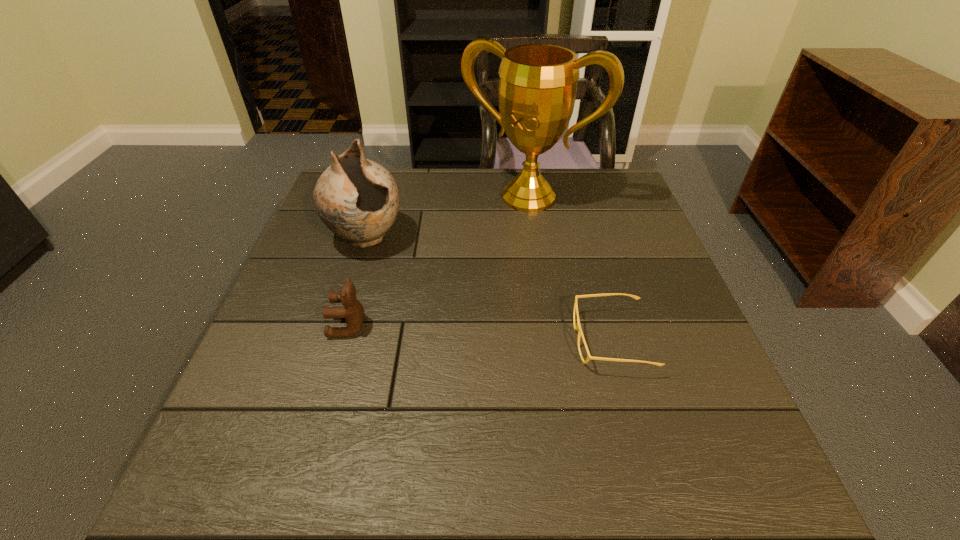
Where is `free space located on the front-facing side of the tallest object`? free space located on the front-facing side of the tallest object is located at coordinates (499, 225).

Image resolution: width=960 pixels, height=540 pixels. I want to click on vacant space located on the front-facing side of the tallest object, so click(488, 244).

Image resolution: width=960 pixels, height=540 pixels. Identify the location of vacant point located 0.270m from the spout of the second tallest object. (445, 321).

At what (x,y) coordinates should I click in order to perform the action: click on free spot located from the spout of the second tallest object. Please return your answer as a coordinate pair (x, y). Looking at the image, I should click on (445, 321).

Locate an element on the screen. The width and height of the screenshot is (960, 540). free space located from the spout of the second tallest object is located at coordinates (416, 291).

I want to click on object that is at the far edge, so click(537, 89).

Locate an element on the screen. teddy bear that is at the left edge is located at coordinates (353, 312).

Locate an element on the screen. pottery present at the left edge is located at coordinates (358, 199).

At what (x,y) coordinates should I click in order to perform the action: click on spectacles at the right edge. Please return your answer as a coordinate pair (x, y). The height and width of the screenshot is (540, 960). Looking at the image, I should click on (578, 327).

Locate an element on the screen. This screenshot has height=540, width=960. award present at the right edge is located at coordinates (537, 89).